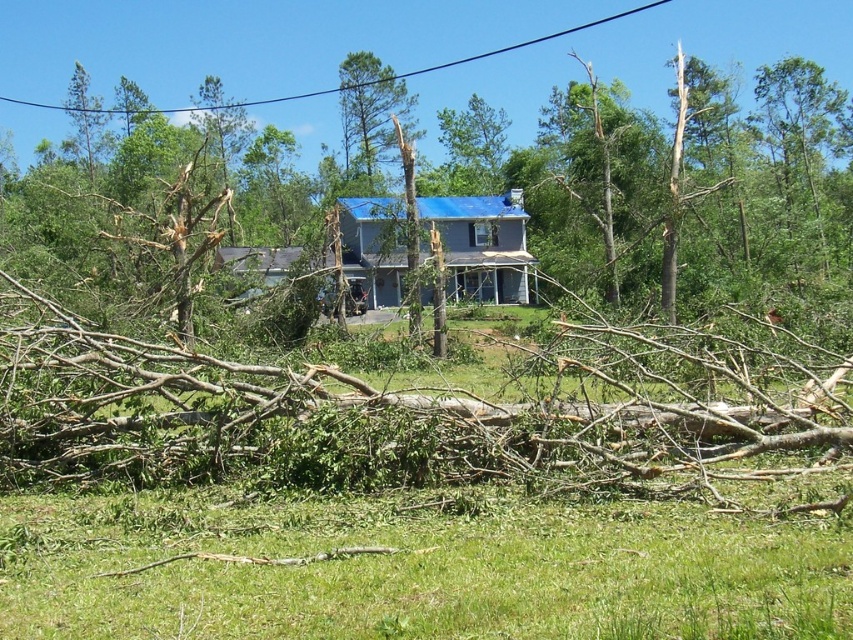
Looking at this image, who is taller, brown wood tree at center or black wire at upper center?

With more height is brown wood tree at center.

Is brown wood tree at center shorter than black wire at upper center?

No, brown wood tree at center is not shorter than black wire at upper center.

Who is more distant from viewer, (596, 186) or (656, 4)?

Point (656, 4)

Locate an element on the screen. brown wood tree at center is located at coordinates tap(676, 180).

Who is positioned more to the right, brown wood tree at center or green rough bark tree at center?

brown wood tree at center is more to the right.

The width and height of the screenshot is (853, 640). What do you see at coordinates (676, 180) in the screenshot?
I see `brown wood tree at center` at bounding box center [676, 180].

The image size is (853, 640). Identify the location of brown wood tree at center. (676, 180).

Is the position of green rough bark tree at center more distant than that of black wire at upper center?

That is False.

Can you confirm if green rough bark tree at center is positioned above black wire at upper center?

Actually, green rough bark tree at center is below black wire at upper center.

Measure the distance between green rough bark tree at center and camera.

green rough bark tree at center is 48.19 meters away from camera.

Image resolution: width=853 pixels, height=640 pixels. In order to click on green rough bark tree at center in this screenshot , I will do `click(370, 116)`.